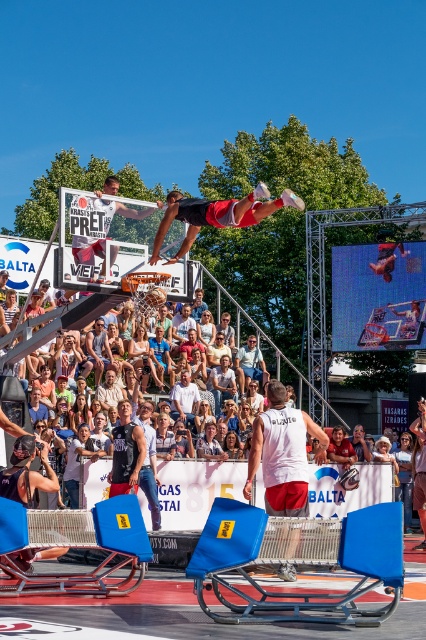
In the scene shown: You are a photographer at the basketball court and you need to capture a photo of the black leather jacket at center and the light brown leather jacket at center. Which jacket is placed on top of the other?

The black leather jacket at center is positioned over light brown leather jacket at center, so the black leather jacket is on top.

You are a photographer standing at the edge of the basketball court. You want to take a photo that includes both the white cotton shirt at center and the light brown leather jacket at center without any obstructions. Given that your camera has a maximum focus range of 8 meters, will you be able to capture both subjects in focus?

The distance between the white cotton shirt at center and the light brown leather jacket at center is 7.75 meters, which is within the camera maximum focus range of 8 meters. Therefore, you can capture both subjects in focus.